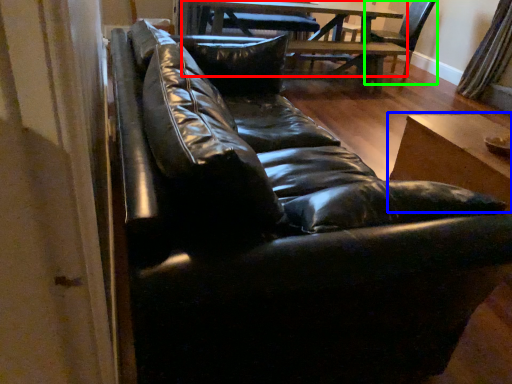
Question: Estimate the real-world distances between objects in this image. Which object is closer to table (highlighted by a red box), table (highlighted by a blue box) or swivel chair (highlighted by a green box)?

Choices:
 (A) table
 (B) swivel chair

Answer: (B)